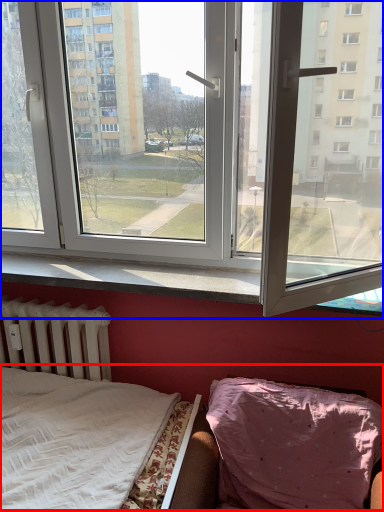
Question: Among these objects, which one is farthest to the camera, hospital bed (highlighted by a red box) or window (highlighted by a blue box)?

Choices:
 (A) hospital bed
 (B) window

Answer: (B)